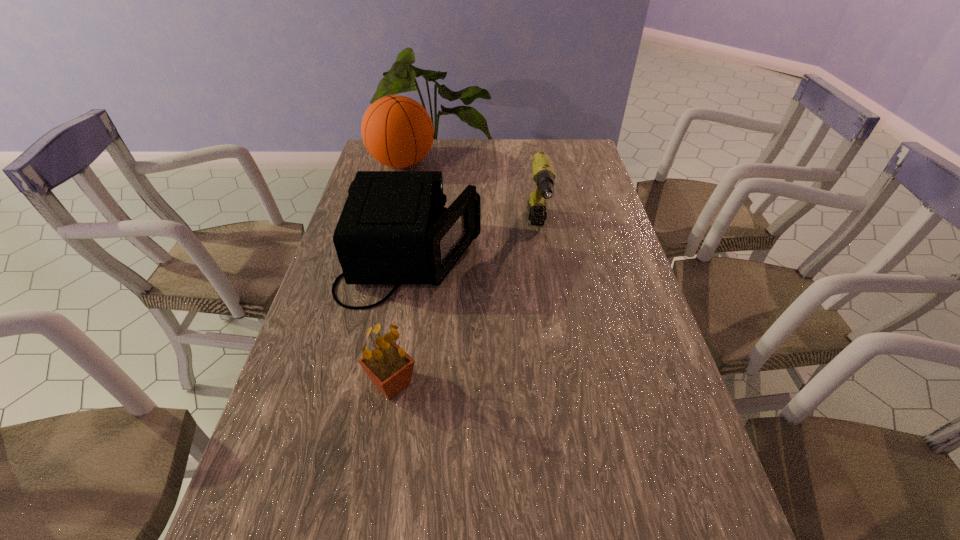
Find the location of `the farthest object`. the farthest object is located at coordinates (397, 131).

Identify the location of the rightmost object. (543, 173).

Identify the location of the nearest object. (390, 368).

Image resolution: width=960 pixels, height=540 pixels. Find the location of `microwave oven`. microwave oven is located at coordinates (x=394, y=229).

At what (x,y) coordinates should I click in order to perform the action: click on free location located on the back of the basketball. Please return your answer as a coordinate pair (x, y). The height and width of the screenshot is (540, 960). Looking at the image, I should click on (408, 141).

Identify the location of vacant space located 0.160m on the handle side of the rightmost object. (547, 291).

Locate an element on the screen. The height and width of the screenshot is (540, 960). vacant area located at the front of the nearest object with flowers visible is located at coordinates (557, 384).

The width and height of the screenshot is (960, 540). What are the coordinates of `free spot located with the door open on the microwave oven` in the screenshot? It's located at (552, 258).

Image resolution: width=960 pixels, height=540 pixels. Identify the location of object that is at the far edge. (397, 131).

Find the location of a particular element. basketball located in the left edge section of the desktop is located at coordinates (397, 131).